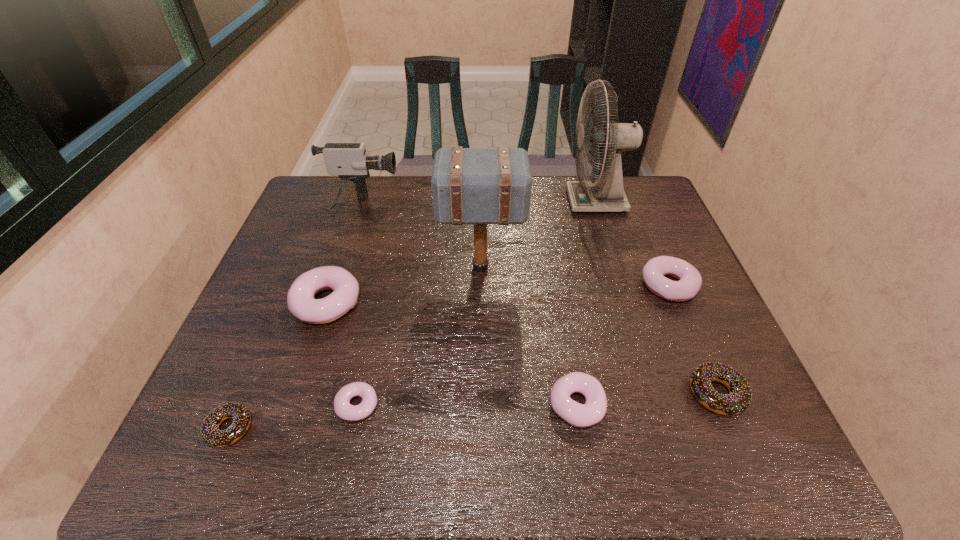
Locate an element on the screen. The height and width of the screenshot is (540, 960). free area in between the sixth object from left to right and the smallest purple doughnut is located at coordinates (467, 405).

You are a GUI agent. You are given a task and a screenshot of the screen. Output one action in this format:
    pyautogui.click(x=<x>, y=<y>)
    Task: Click on the vacant area that lies between the fourth doughnut from right to left and the bigger chocolate doughnut
    
    Given the screenshot: What is the action you would take?
    pyautogui.click(x=537, y=399)

This screenshot has height=540, width=960. I want to click on vacant space that is in between the second tallest doughnut and the third doughnut from left to right, so click(513, 345).

Locate an element on the screen. The width and height of the screenshot is (960, 540). free space between the fourth object from right to left and the tallest doughnut is located at coordinates (451, 354).

Locate an element on the screen. This screenshot has width=960, height=540. free spot between the smallest purple doughnut and the bigger chocolate doughnut is located at coordinates (537, 399).

Identify the location of vacant region between the gray fan and the gray mallet. (539, 234).

Where is `unoccupied area between the left chocolate doughnut and the gray fan`? The height and width of the screenshot is (540, 960). unoccupied area between the left chocolate doughnut and the gray fan is located at coordinates (413, 315).

The width and height of the screenshot is (960, 540). Find the location of `free spot between the gray mallet and the bigger chocolate doughnut`. free spot between the gray mallet and the bigger chocolate doughnut is located at coordinates (599, 330).

The height and width of the screenshot is (540, 960). I want to click on object that stands as the fifth closest to the third tallest object, so click(210, 432).

Locate which object is the fourth closest to the right chocolate doughnut. Please provide its 2D coordinates. Your answer should be formatted as a tuple, i.e. [(x, y)], where the tuple contains the x and y coordinates of a point satisfying the conditions above.

[(607, 194)]